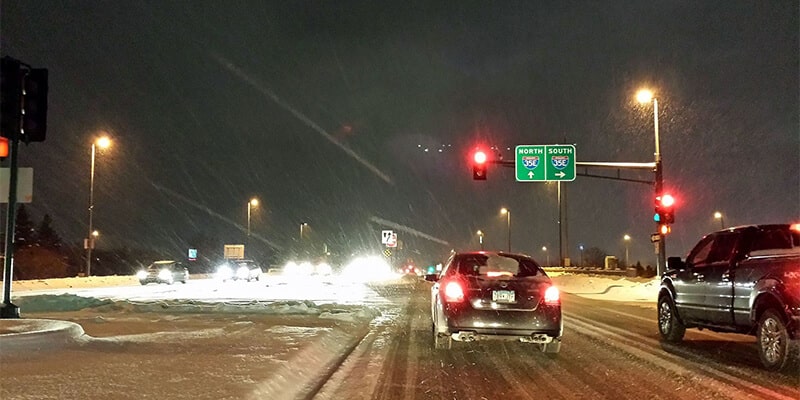
Identify the location of windows. (160, 262), (178, 266), (238, 268), (494, 274), (709, 251), (776, 232).